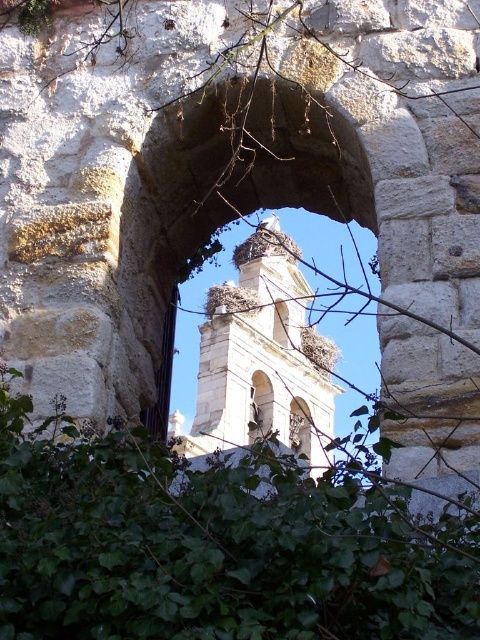
You are standing in front of the stone archway and see the green leafy plant at center and the white stone bell tower at center. Which object is nearer to you?

The green leafy plant at center is closer to the viewer than the white stone bell tower at center, so the green leafy plant at center is nearer to you.

You are standing in a garden and see the green leafy plant at center and the brown textured nest at center through the stone archway. Which object is positioned to the right side?

The green leafy plant at center is positioned to the right of the brown textured nest at center.